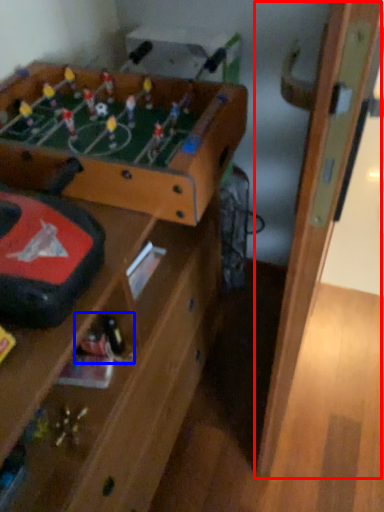
Question: Which point is further to the camera, door (highlighted by a red box) or toy (highlighted by a blue box)?

Choices:
 (A) door
 (B) toy

Answer: (B)